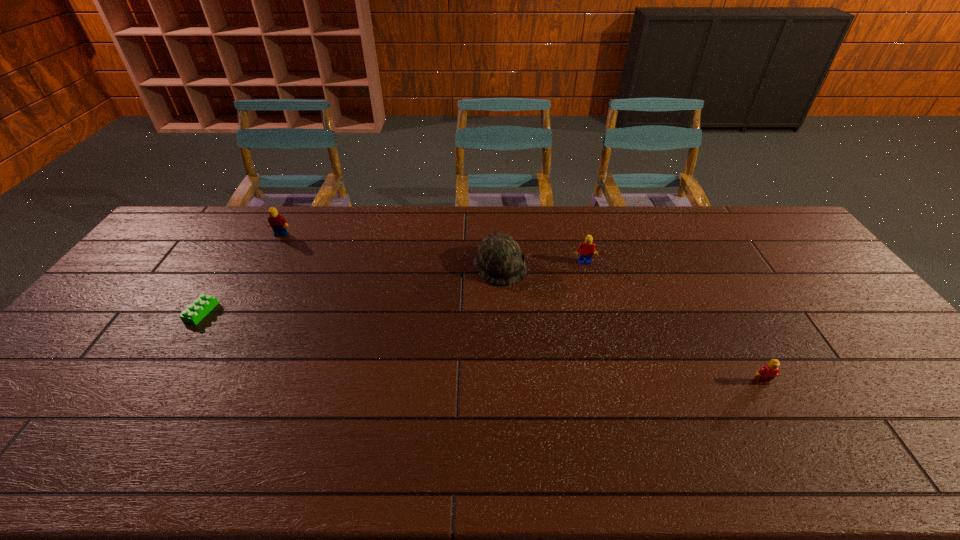
In the image, there is a desktop. Identify the location of vacant region at the far right corner. This screenshot has height=540, width=960. (782, 229).

Where is `vacant region between the headwear and the shortest Lego`? The width and height of the screenshot is (960, 540). vacant region between the headwear and the shortest Lego is located at coordinates (350, 289).

Identify the location of free space between the third Lego from right to left and the leftmost object. (241, 273).

Locate an element on the screen. The height and width of the screenshot is (540, 960). vacant point located between the rightmost object and the headwear is located at coordinates (631, 324).

This screenshot has width=960, height=540. In order to click on unoccupied area between the leftmost Lego and the farthest Lego in this screenshot , I will do coord(241,273).

This screenshot has height=540, width=960. In order to click on vacant space that is in between the second object from left to right and the second shortest object in this screenshot , I will do `click(521, 308)`.

You are a GUI agent. You are given a task and a screenshot of the screen. Output one action in this format:
    pyautogui.click(x=<x>, y=<y>)
    Task: Click on the free spot between the third object from left to right and the farthest object
    This screenshot has height=540, width=960.
    Given the screenshot: What is the action you would take?
    pyautogui.click(x=391, y=250)

Where is `free spot between the third Lego from right to left and the fourth object from left to right`? free spot between the third Lego from right to left and the fourth object from left to right is located at coordinates (432, 249).

The image size is (960, 540). What are the coordinates of `vacant space in between the headwear and the rightmost object` in the screenshot? It's located at (631, 324).

This screenshot has height=540, width=960. In order to click on unoccupied area between the second Lego from right to left and the headwear in this screenshot , I will do `click(541, 265)`.